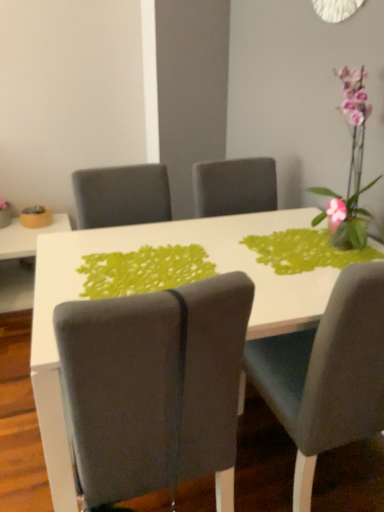
Question: Do you think suede gray chair at center, which ranks as the 2th chair in right-to-left order, is within pink glass vase at upper right, or outside of it?

Choices:
 (A) inside
 (B) outside

Answer: (B)

Question: Based on their positions, is suede gray chair at center, which appears as the 1th chair when viewed from the left, located to the left or right of pink glass vase at upper right?

Choices:
 (A) right
 (B) left

Answer: (B)

Question: Estimate the real-world distances between objects in this image. Which object is closer to the white glossy table at lower left, the second table positioned from the right?

Choices:
 (A) white glossy table at center, the 2th table when ordered from left to right
 (B) matte yellow bowl at left
 (C) pink glass vase at upper right
 (D) velvet gray chair at right, the 1th chair from the right
 (E) suede gray chair at center, which ranks as the 2th chair in right-to-left order

Answer: (B)

Question: Based on their relative distances, which object is farther from the matte yellow bowl at left?

Choices:
 (A) green fabric placemat at center
 (B) white glossy table at lower left, the second table positioned from the right
 (C) velvet gray chair at right, the 1th chair from the right
 (D) pink glass vase at upper right
 (E) white glossy table at center, which is the 1th table in front-to-back order

Answer: (C)